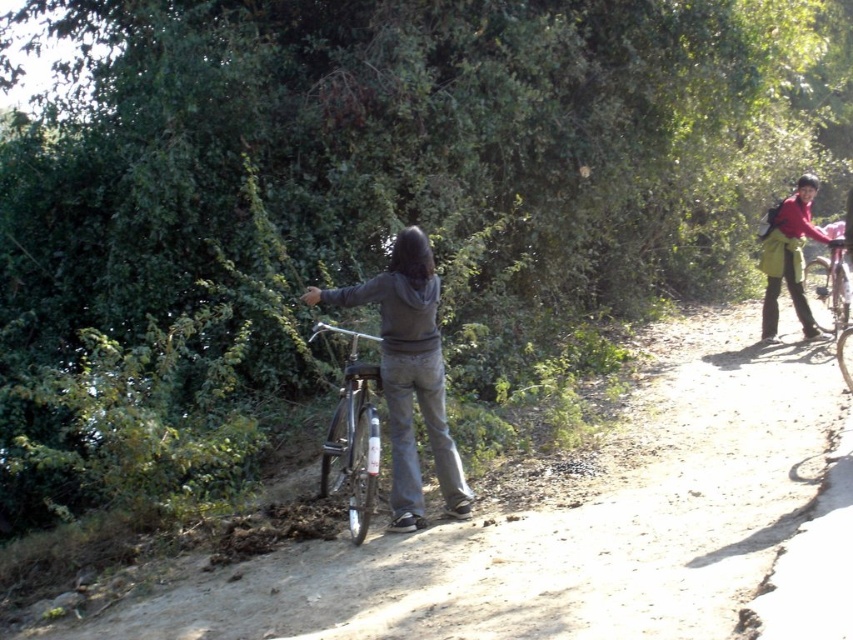
Based on the photo, you are a hiker who needs to reach the red fabric backpack at upper right from the shiny metallic bicycle at center. Can you walk directly to it without needing to go around any obstacles?

The distance between the shiny metallic bicycle at center and the red fabric backpack at upper right is 6.92 meters. There are no obstacles mentioned in the scene description, so you can walk directly to it.

You are standing at point (340, 435) and want to walk to the person near the bicycle in the foreground. Which direction should you move relative to point (601, 618) to reach your destination?

You should move towards point (601, 618) because it is in front of point (340, 435), meaning the person near the bicycle is closer to that point.

You are planning to take a photo of the shiny metallic bicycle at center and the red fabric backpack at upper right. Which object should you focus on if you want to capture both in the frame without moving the camera?

The shiny metallic bicycle at center is smaller than the red fabric backpack at upper right. Therefore, to include both in the frame without moving the camera, you should focus on the shiny metallic bicycle at center since it is smaller and might require a wider angle or adjustment to ensure both fit.